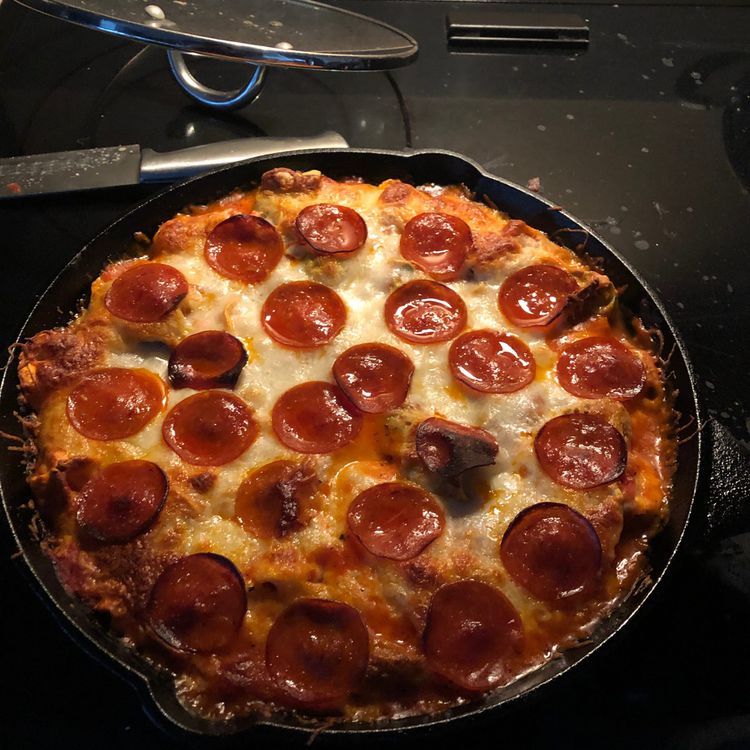
In order to click on pan cover in this screenshot , I will do `click(226, 25)`.